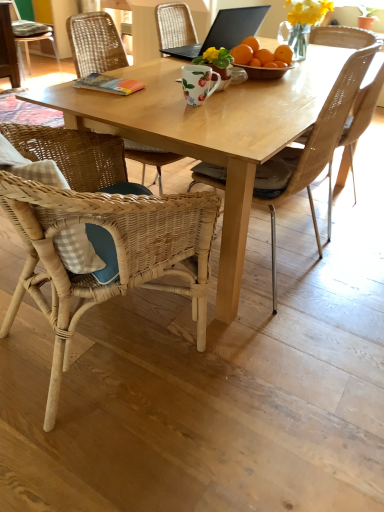
Question: Is point (87, 186) positioned closer to the camera than point (379, 39)?

Choices:
 (A) farther
 (B) closer

Answer: (B)

Question: Is woven wicker chair at lower left, arranged as the third chair when viewed from the right, taller or shorter than woven wicker chair at right, which is the 3th chair from front to back?

Choices:
 (A) tall
 (B) short

Answer: (B)

Question: Estimate the real-world distances between objects in this image. Which object is farther from the woven wicker chair at right, the second chair viewed from the back?

Choices:
 (A) black matte laptop at upper center
 (B) woven wicker chair at lower left, the 4th chair when ordered from back to front
 (C) woven wood chair at upper left, which is the 1th chair from back to front
 (D) green leafy plant at upper right
 (E) woven wood chair at center, acting as the 2th chair starting from the right

Answer: (C)

Question: Which object is the closest to the floral matte coffee cup at center?

Choices:
 (A) woven wood chair at upper left, which is the fourth chair from front to back
 (B) woven wicker chair at right, the second chair viewed from the back
 (C) woven wicker chair at lower left, which ranks as the 1th chair in front-to-back order
 (D) woven wood chair at center, the 2th chair in the front-to-back sequence
 (E) black matte laptop at upper center

Answer: (D)